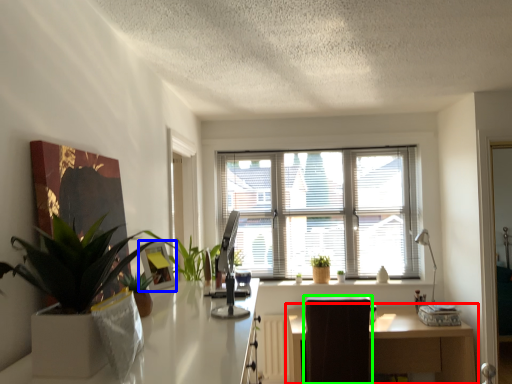
Question: Which object is the farthest from table (highlighted by a red box)? Choose among these: picture frame (highlighted by a blue box) or swivel chair (highlighted by a green box).

Choices:
 (A) picture frame
 (B) swivel chair

Answer: (A)